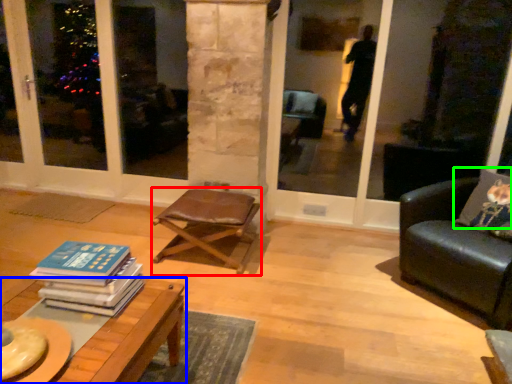
Question: Considering the real-world distances, which object is closest to chair (highlighted by a red box)? table (highlighted by a blue box) or pillow (highlighted by a green box).

Choices:
 (A) table
 (B) pillow

Answer: (A)